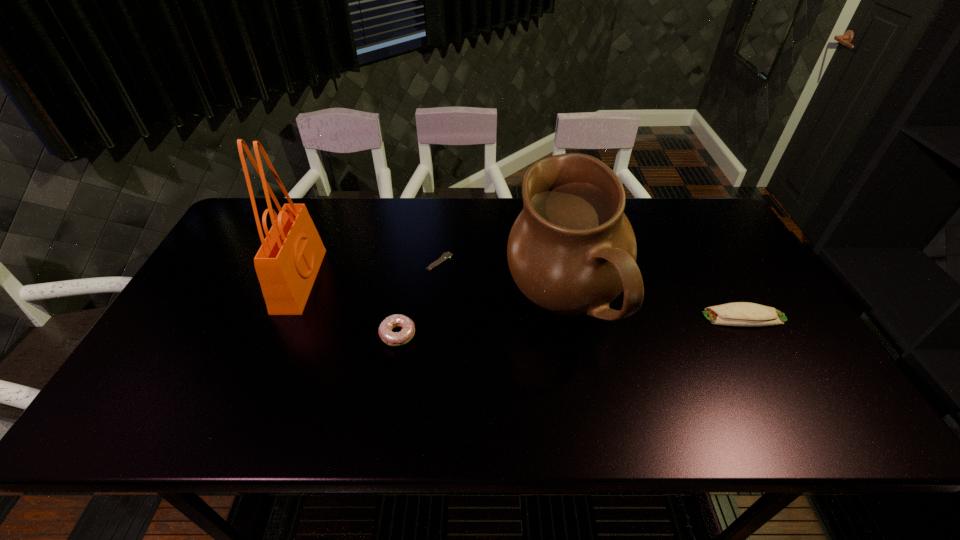
In order to click on tote bag in this screenshot , I will do `click(287, 263)`.

You are a GUI agent. You are given a task and a screenshot of the screen. Output one action in this format:
    pyautogui.click(x=<x>, y=<y>)
    Task: Click on the second object from right to left
    
    Given the screenshot: What is the action you would take?
    pyautogui.click(x=572, y=250)

The width and height of the screenshot is (960, 540). In order to click on the second tallest object in this screenshot , I will do `click(572, 250)`.

Identify the location of the third shortest object. (407, 332).

Identify the location of the fourth object from right to left. This screenshot has width=960, height=540. (407, 332).

Locate an element on the screen. The image size is (960, 540). the fourth tallest object is located at coordinates (738, 313).

The height and width of the screenshot is (540, 960). I want to click on burrito, so click(738, 313).

The width and height of the screenshot is (960, 540). Identify the location of the shortest object. (446, 255).

Identify the location of watch. The height and width of the screenshot is (540, 960). (446, 255).

The height and width of the screenshot is (540, 960). Identify the location of blank space located 0.120m on the logo side of the leftmost object. (358, 281).